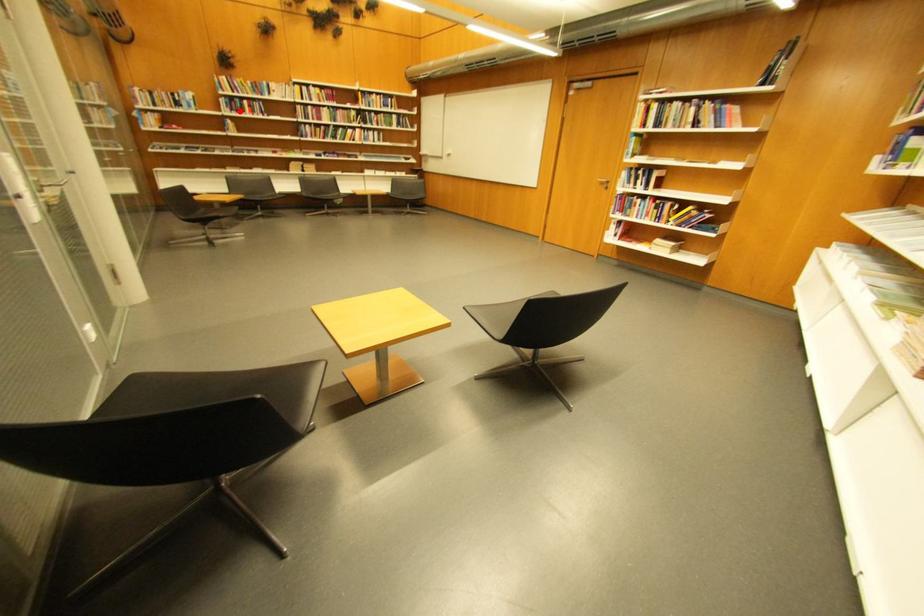
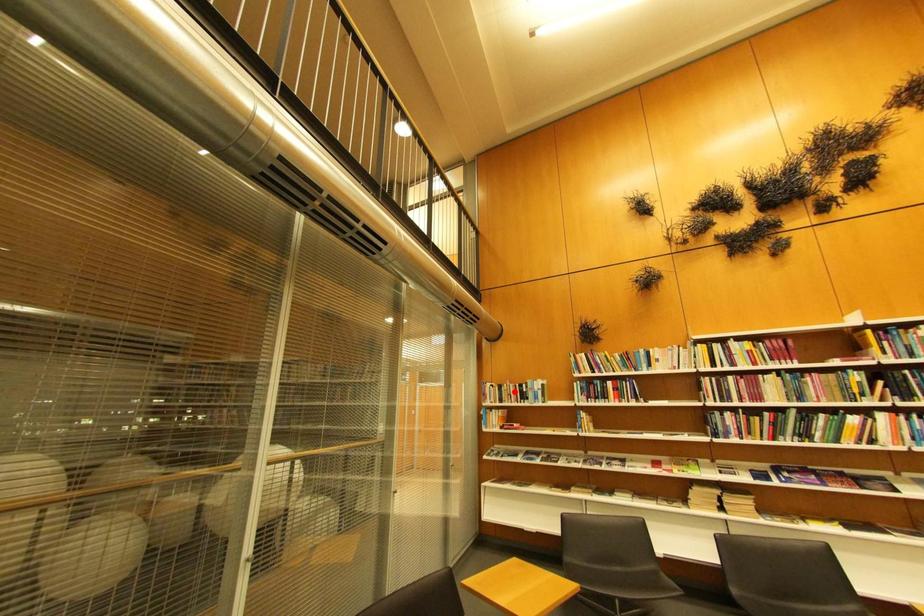
I am providing you with two images of the same scene from different viewpoints. A red point is marked on the first image and another point is marked on the second image. Do the highlighted points in image1 and image2 indicate the same real-world spot?

No